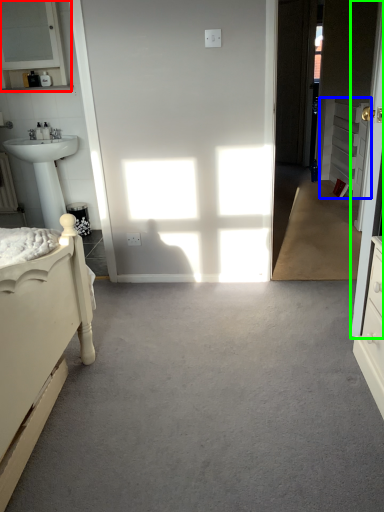
Question: Which is nearer to the medicine cabinet (highlighted by a red box)? cabinetry (highlighted by a blue box) or door (highlighted by a green box).

Choices:
 (A) cabinetry
 (B) door

Answer: (B)